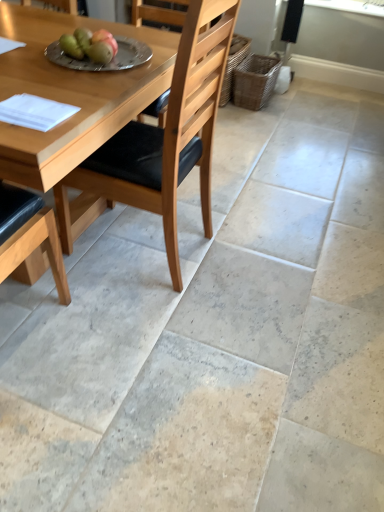
Question: From the image's perspective, is woven brown basket at right above or below green matte apple at upper left, acting as the 2th fruit starting from the right?

Choices:
 (A) above
 (B) below

Answer: (A)

Question: From a real-world perspective, is woven brown basket at right positioned above or below green matte apple at upper left, acting as the 2th fruit starting from the right?

Choices:
 (A) below
 (B) above

Answer: (A)

Question: Which object is positioned closest to the light brown wood chair at center?

Choices:
 (A) green matte pears at upper center, the second fruit from the left
 (B) green matte apple at upper left, the 1th fruit from the left
 (C) silver metallic plate at upper center
 (D) woven brown basket at right
 (E) white paper at lower left

Answer: (C)

Question: Which object is the farthest from the light brown wood chair at center?

Choices:
 (A) green matte pears at upper center, the first fruit in the right-to-left sequence
 (B) woven brown basket at right
 (C) white paper at lower left
 (D) silver metallic plate at upper center
 (E) green matte apple at upper left, acting as the 2th fruit starting from the right

Answer: (B)